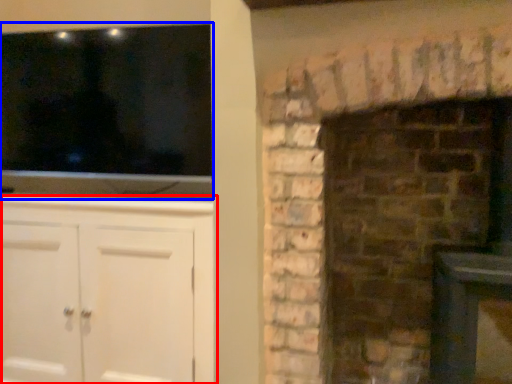
Question: Which object is closer to the camera taking this photo, cabinetry (highlighted by a red box) or window (highlighted by a blue box)?

Choices:
 (A) cabinetry
 (B) window

Answer: (A)